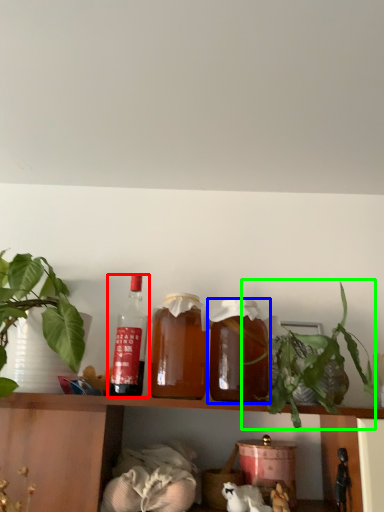
Question: Which is nearer to the bottle (highlighted by a red box)? bottle (highlighted by a blue box) or houseplant (highlighted by a green box).

Choices:
 (A) bottle
 (B) houseplant

Answer: (A)